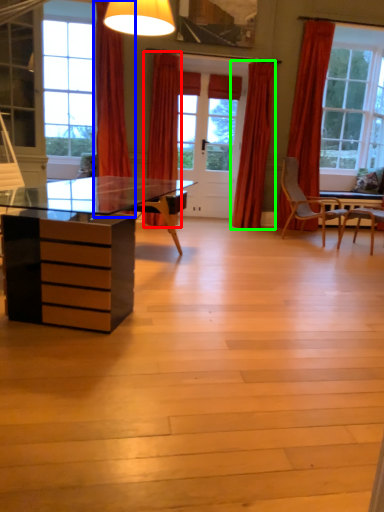
Question: Which object is positioned closest to curtain (highlighted by a red box)? Select from curtain (highlighted by a blue box) and curtain (highlighted by a green box).

Choices:
 (A) curtain
 (B) curtain

Answer: (A)